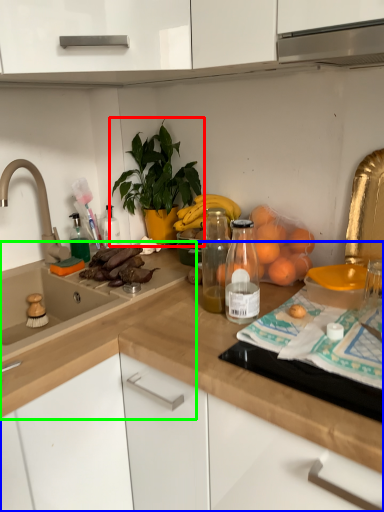
Question: Based on their relative distances, which object is nearer to houseplant (highlighted by a red box)? Choose from countertop (highlighted by a blue box) and countertop (highlighted by a green box).

Choices:
 (A) countertop
 (B) countertop

Answer: (B)